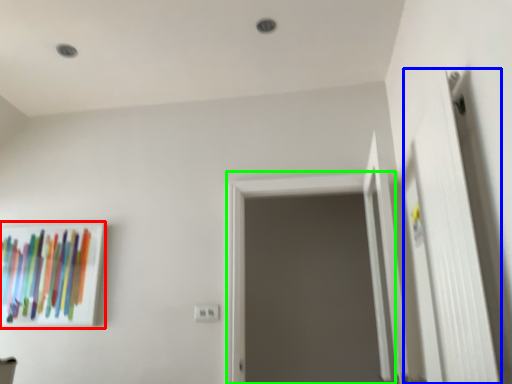
Question: Which object is positioned farthest from picture frame (highlighted by a red box)? Select from door (highlighted by a blue box) and screen door (highlighted by a green box).

Choices:
 (A) door
 (B) screen door

Answer: (A)